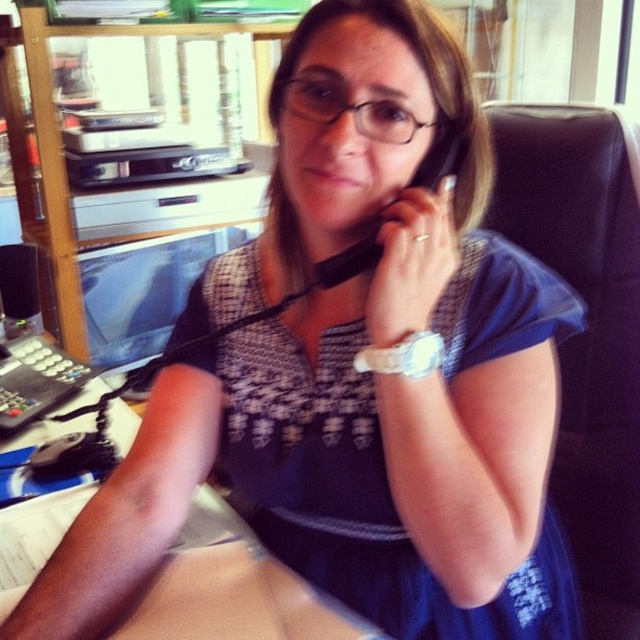
Question: Based on their relative distances, which object is nearer to the black leather chair at right?

Choices:
 (A) black rubberized phone at center
 (B) wooden table at lower center

Answer: (A)

Question: Can you confirm if blue woven dress at center is positioned to the left of wooden table at lower center?

Choices:
 (A) yes
 (B) no

Answer: (B)

Question: Which object is the closest to the black leather chair at right?

Choices:
 (A) wooden table at lower center
 (B) black rubberized phone at center
 (C) blue woven dress at center

Answer: (C)

Question: Which of the following is the farthest from the observer?

Choices:
 (A) black rubberized phone at center
 (B) black leather chair at right
 (C) wooden table at lower center

Answer: (B)

Question: Can you confirm if wooden table at lower center is thinner than black rubberized phone at center?

Choices:
 (A) no
 (B) yes

Answer: (A)

Question: Can you confirm if blue woven dress at center is positioned above black rubberized phone at center?

Choices:
 (A) no
 (B) yes

Answer: (A)